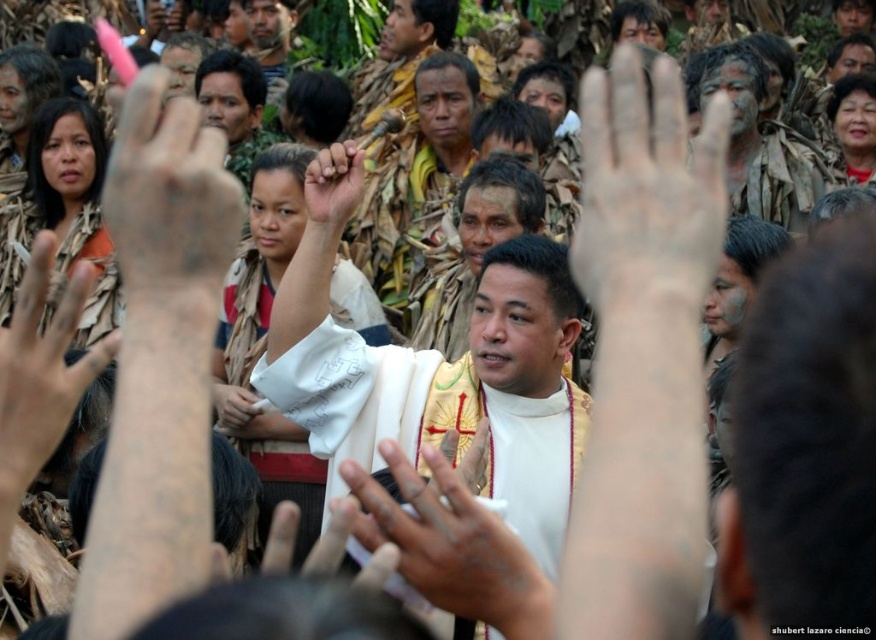
Who is taller, brown textured hand at left or smooth white cloth at center?

With more height is brown textured hand at left.

Find the location of a particular element. brown textured hand at left is located at coordinates click(x=41, y=369).

Between white clothed man at center and brown leather hand at center, which one is positioned higher?

brown leather hand at center

Which is in front, point (516, 372) or point (350, 202)?

Point (350, 202)

This screenshot has height=640, width=876. In order to click on white clothed man at center in this screenshot , I will do `click(444, 380)`.

Between dirty face paint at center and brown leather hand at center, which one appears on the right side from the viewer's perspective?

dirty face paint at center is more to the right.

Which of these two, dirty face paint at center or brown leather hand at center, stands taller?

With more height is dirty face paint at center.

Where is `dirty face paint at center`? dirty face paint at center is located at coordinates (760, 144).

This screenshot has width=876, height=640. Identify the location of dirty face paint at center. (760, 144).